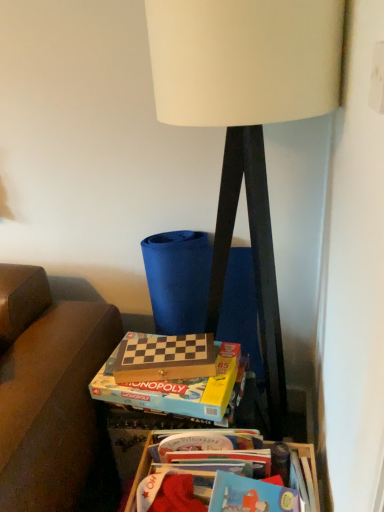
The height and width of the screenshot is (512, 384). Find the location of `free space above wooden chess set at lower center, which is the 2th paperback book from front to back (from a real-world perspective)`. free space above wooden chess set at lower center, which is the 2th paperback book from front to back (from a real-world perspective) is located at coordinates (165, 349).